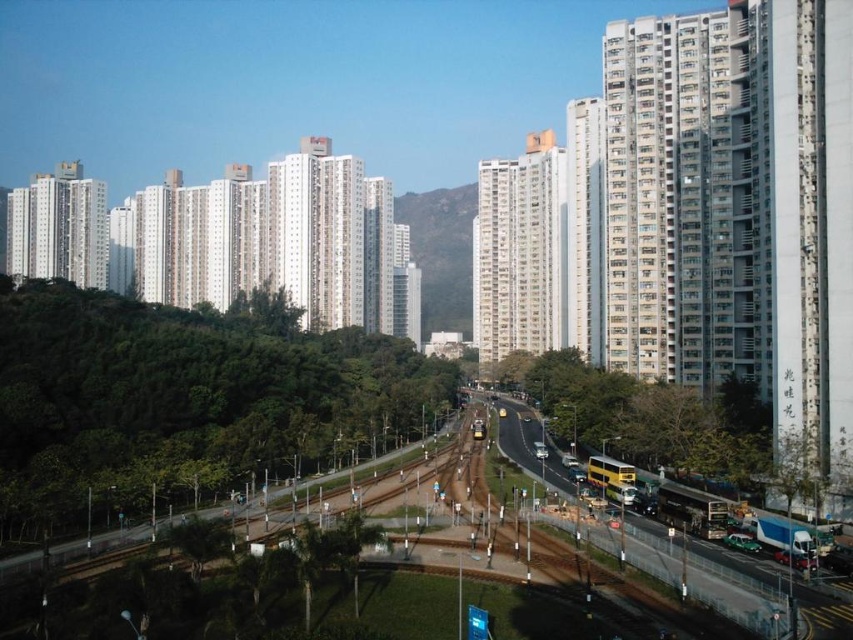
Question: Can you confirm if yellow double-decker bus at center is positioned below green textured hillside at center?

Choices:
 (A) no
 (B) yes

Answer: (B)

Question: Among these objects, which one is farthest from the camera?

Choices:
 (A) yellow double-decker bus at center
 (B) green textured hillside at center

Answer: (B)

Question: Where is yellow double-decker bus at center located in relation to green textured hillside at center in the image?

Choices:
 (A) left
 (B) right

Answer: (B)

Question: Is yellow double-decker bus at center in front of green textured hillside at center?

Choices:
 (A) no
 (B) yes

Answer: (B)